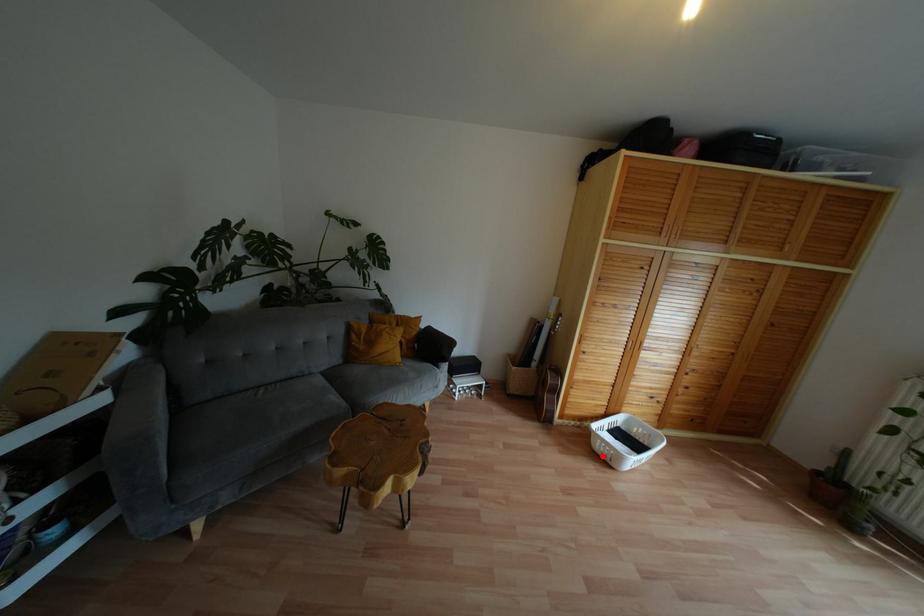
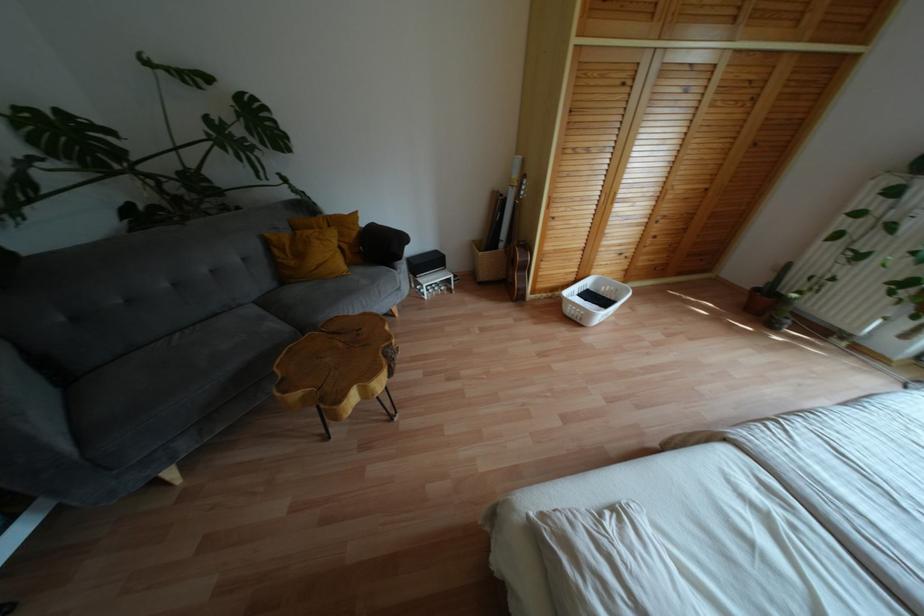
Locate, in the second image, the point that corresponds to the highlighted location in the first image.

(573, 318)